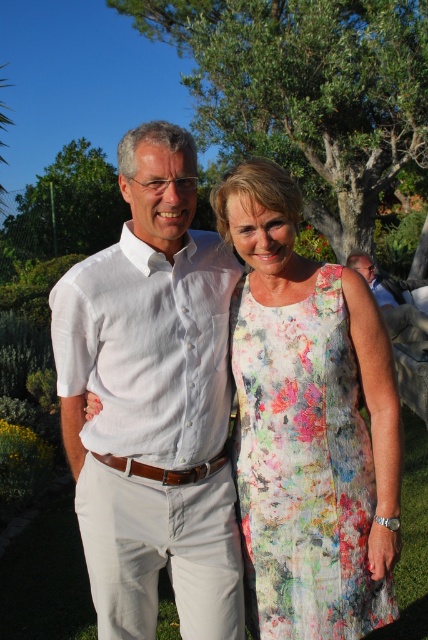
You are at a social gathering and want to take a photo of the white linen shirt at center. Where should you position yourself to capture it in the frame?

The white linen shirt at center is located at point (152, 403), so position yourself so that the center of your camera frame aligns with those coordinates to capture it.

You are a photographer setting up for an outdoor event. You need to ensure that the floral printed fabric dress at center and the matte brown leather belt at lower right are both visible in your shot. Given their sizes, which object might require you to adjust your camera angle to include its full width?

The floral printed fabric dress at center has a larger width than the matte brown leather belt at lower right, so you might need to adjust your camera angle to ensure the entire dress is captured in the frame.

You are taking a photo of two people at an event. You notice two points in the image labeled as point (139, 570) and point (397, 333). Which point is closer to your camera?

Point (139, 570) is closer to the camera than point (397, 333).